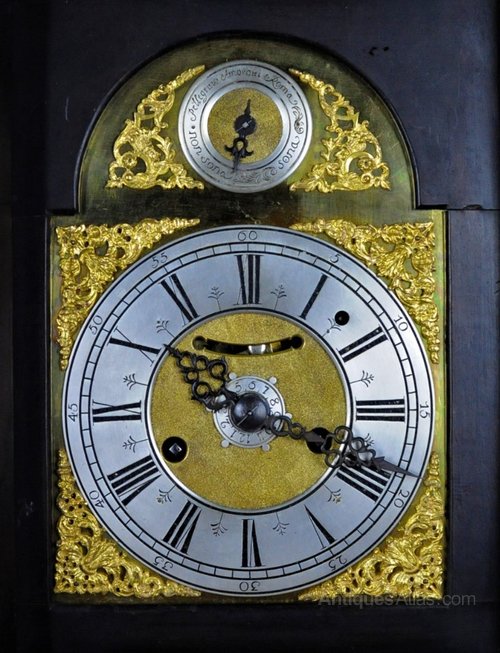
Find the location of a particular element. Image resolution: width=500 pixels, height=653 pixels. top of vintage clock is located at coordinates (454, 91).